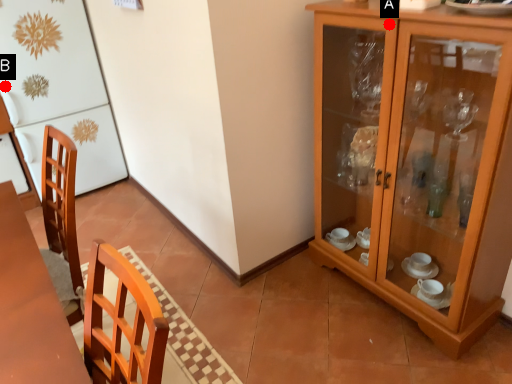
Question: Two points are circled on the image, labeled by A and B beside each circle. Among these points, which one is farthest from the camera?

Choices:
 (A) A is further
 (B) B is further

Answer: (B)